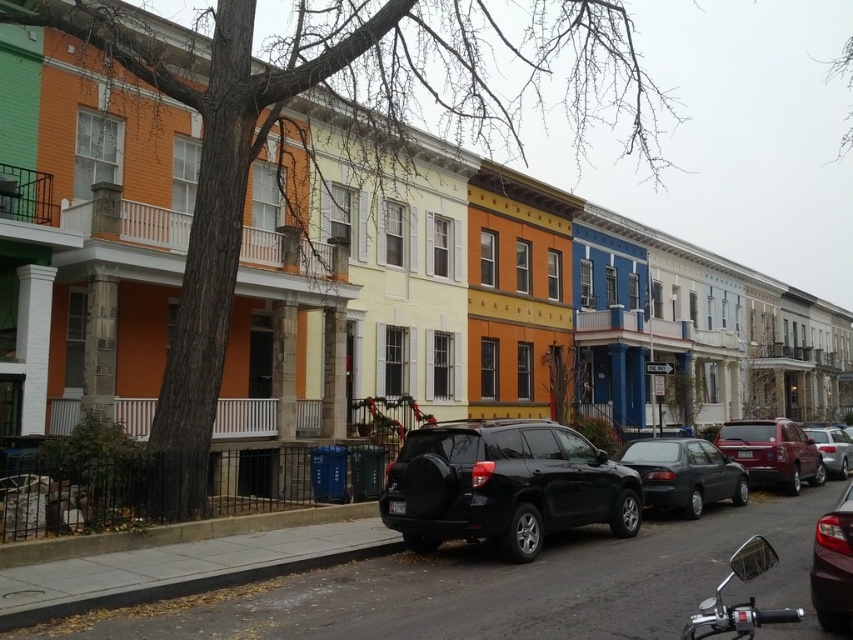
You are a delivery person who needs to park your vehicle between the black matte suv at center and the shiny dark red sedan at lower right. Given that your delivery van is 1.8 meters tall, can you safely park there without hitting the vehicles?

The black matte suv at center is taller than the shiny dark red sedan at lower right. Since the delivery van is 1.8 meters tall, and the black matte suv at center has a greater height, you need to ensure that the parking space between them accommodates the van. However, the height comparison alone doesn

You are driving a delivery van that is 2 meters wide. You need to park between the matte black sedan at center and the shiny red suv at center right. Is there enough space for your van?

The matte black sedan at center is closer to the viewer than the shiny red suv at center right. Since the distance between them depends on their positions, but the description only mentions their relative distance to the viewer, we cannot determine the space between them. Therefore, it is unclear if there is enough space for the van.

You are standing on the street looking at the row of townhouses. There are two points marked on the image, one at coordinate point (689, 449) and another at point (816, 564). Which point is closer to you as you stand in front of the townhouses?

Point (689, 449) is further to the viewer than point (816, 564), so the point closer to you is point (816, 564).